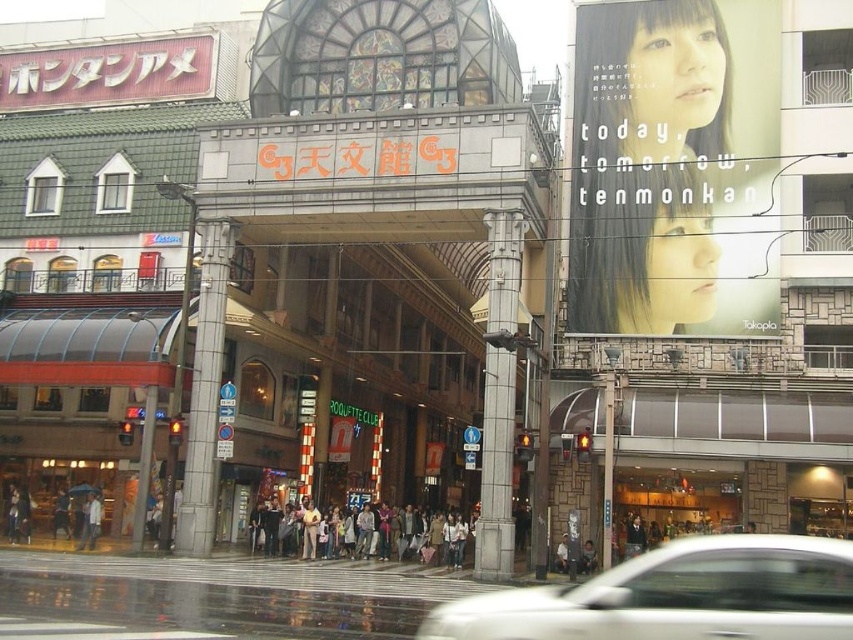
You are standing at the entrance of the building marked by the archway with the text G3. You see two points in the image, point (286,518) and point (579,568). Which point is closer to you?

Point (579,568) is closer to you because it is in front of point (286,518).

You are standing at the entrance of the building marked by the large ornate archway with the text G3. You want to see both the matte black crowd at center and the dark brown leather jacket at center. Which one is closer to you?

The matte black crowd at center and dark brown leather jacket at center are both at center, so they are equidistant from you.

You are standing at the entrance of the building and see a matte black crowd at center and a dark brown leather jacket at center. Which object is closer to the entrance?

The matte black crowd at center is closer to the entrance because it is positioned to the left of the dark brown leather jacket at center, which would place it nearer to the entrance area.